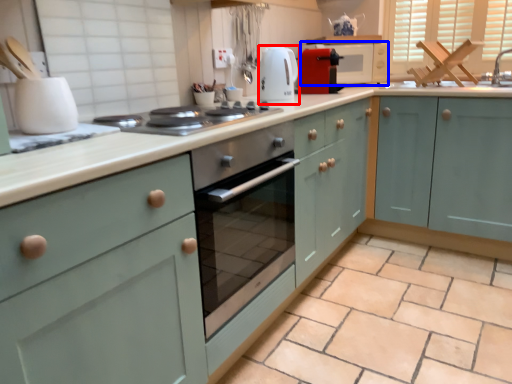
Question: Which point is closer to the camera, kitchen appliance (highlighted by a red box) or microwave (highlighted by a blue box)?

Choices:
 (A) kitchen appliance
 (B) microwave

Answer: (A)